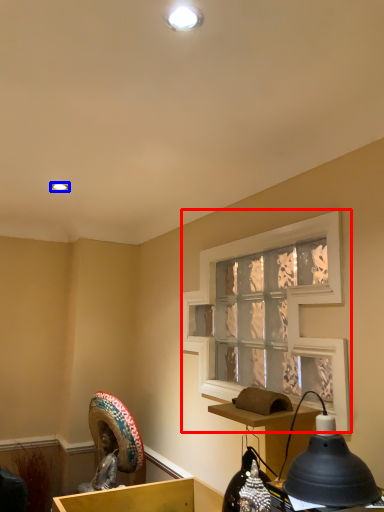
Question: Which point is closer to the camera, window screen (highlighted by a red box) or light (highlighted by a blue box)?

Choices:
 (A) window screen
 (B) light

Answer: (A)